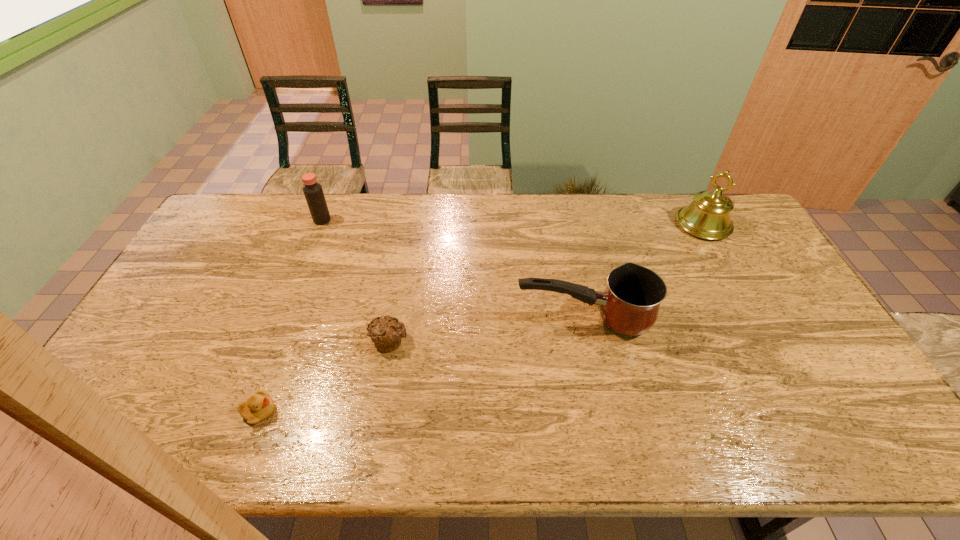
I want to click on the tallest object, so click(x=708, y=216).

The image size is (960, 540). I want to click on the rightmost object, so click(x=708, y=216).

Where is `vinegar`? This screenshot has height=540, width=960. vinegar is located at coordinates (313, 192).

Identify the location of the second object from right to left. This screenshot has width=960, height=540. (630, 304).

Identify the location of the third object from left to right. click(x=386, y=333).

At what (x,y) coordinates should I click in order to perform the action: click on the nearest object. Please return your answer as a coordinate pair (x, y). Image resolution: width=960 pixels, height=540 pixels. Looking at the image, I should click on (258, 407).

Where is `vacant space located 0.200m on the left of the tallest object`? vacant space located 0.200m on the left of the tallest object is located at coordinates (620, 224).

Identify the location of vacant area situated on the front of the vinegar. This screenshot has height=540, width=960. (292, 297).

At what (x,y) coordinates should I click in order to perform the action: click on free space located on the handle side of the saucepan. Please return your answer as a coordinate pair (x, y). This screenshot has height=540, width=960. Looking at the image, I should click on (484, 319).

Find the location of a particular element. The height and width of the screenshot is (540, 960). vacant space located on the handle side of the saucepan is located at coordinates (380, 319).